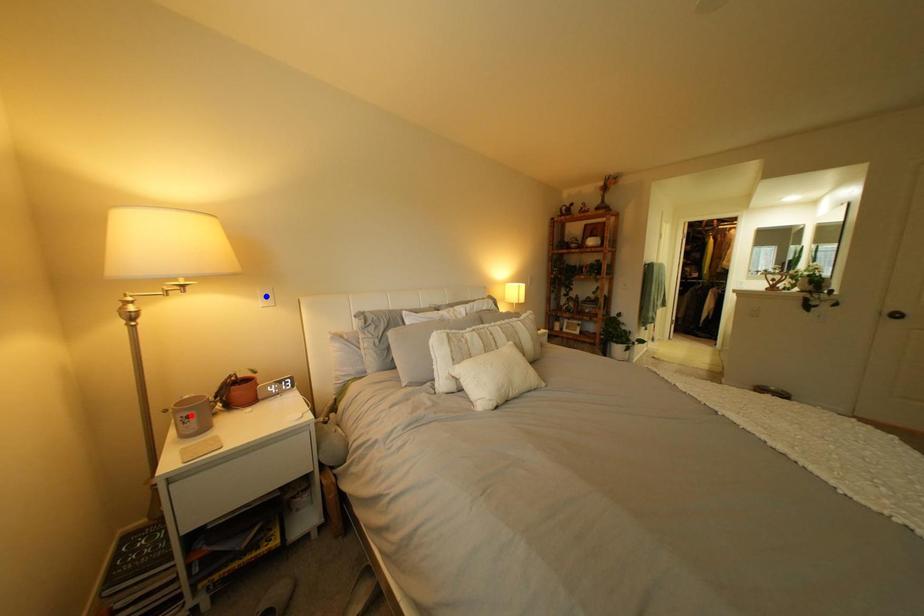
Question: Which of the two points in the image is closer to the camera?

Choices:
 (A) Blue point is closer.
 (B) Red point is closer.

Answer: (B)